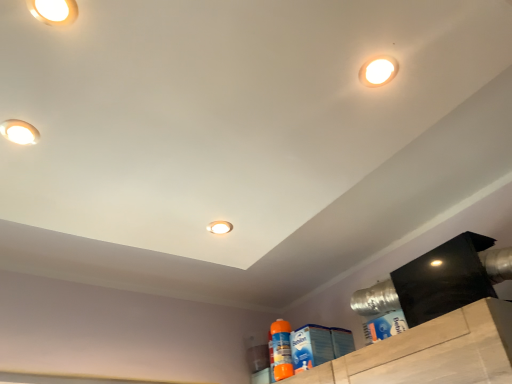
Question: Is white glossy droplight at upper right, arranged as the fourth droplight when viewed from the left, in front of or behind matte white droplight at upper left, which appears as the 3th droplight when viewed from the top, in the image?

Choices:
 (A) behind
 (B) front

Answer: (B)

Question: Considering the positions of white glossy droplight at upper right, which appears as the third droplight when viewed from the back, and matte white droplight at upper left, the second droplight when ordered from back to front, in the image, is white glossy droplight at upper right, which appears as the third droplight when viewed from the back, taller or shorter than matte white droplight at upper left, the second droplight when ordered from back to front,?

Choices:
 (A) short
 (B) tall

Answer: (B)

Question: Which object is the farthest from the orange plastic spray bottle at lower right, the second cleaning product when ordered from right to left?

Choices:
 (A) matte white droplight at upper left, placed as the third droplight when sorted from right to left
 (B) matte white droplight at upper left, which appears as the 3th droplight when viewed from the front
 (C) white glossy droplight at upper right, the 2th droplight when ordered from top to bottom
 (D) blue cardboard box at lower right, the first cleaning product viewed from the front
 (E) matte white droplight at center, the third droplight viewed from the left

Answer: (A)

Question: Estimate the real-world distances between objects in this image. Which object is closer to the blue cardboard box at lower right, placed as the 2th cleaning product when sorted from bottom to top?

Choices:
 (A) matte white droplight at upper left, which is the 1th droplight from top to bottom
 (B) matte white droplight at upper left, the 4th droplight when ordered from right to left
 (C) matte white droplight at center, the first droplight from the bottom
 (D) orange plastic spray bottle at lower right, positioned as the first cleaning product in back-to-front order
 (E) white glossy droplight at upper right, which appears as the 1th droplight when viewed from the right

Answer: (D)